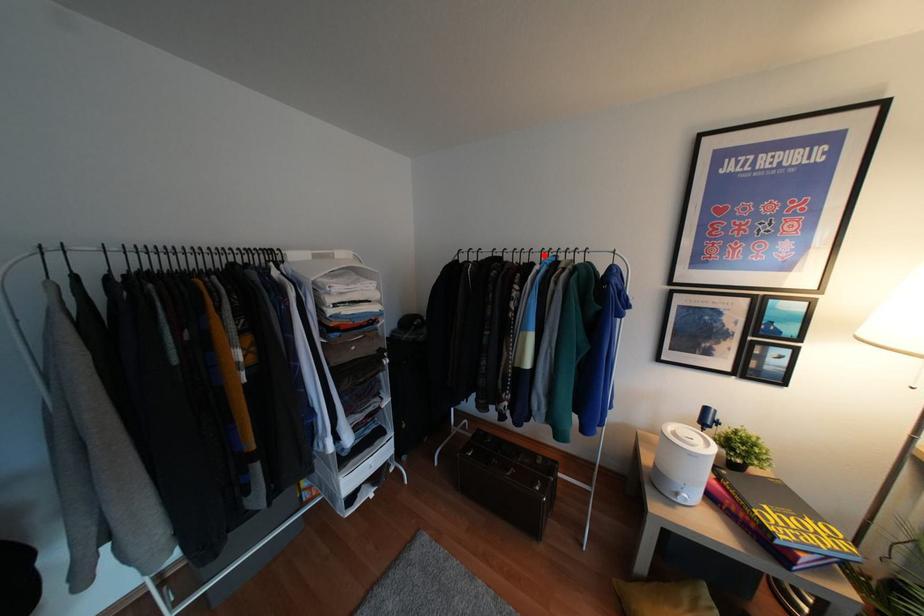
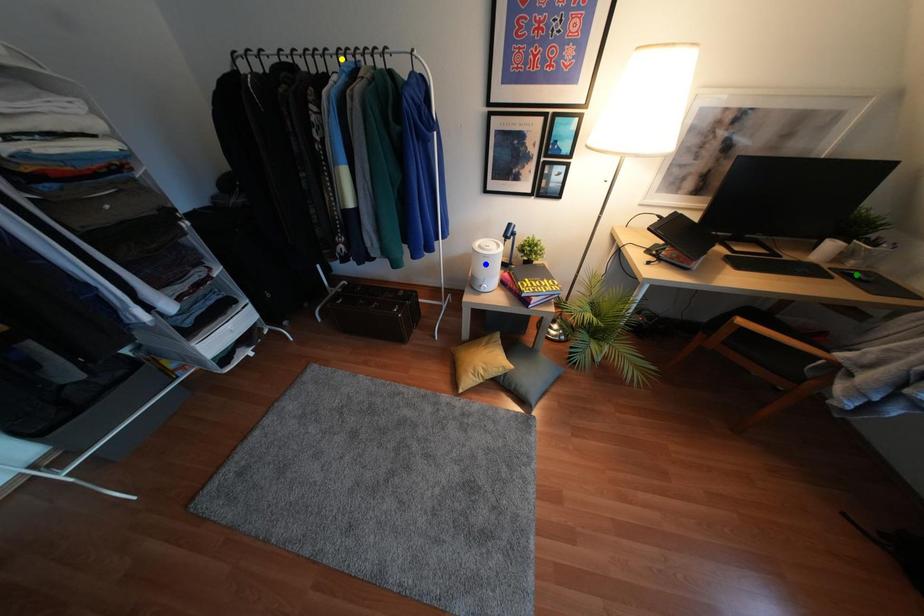
Question: I am providing you with two images of the same scene from different viewpoints. A red point is marked on the first image. You are given multiple points on the second image. Which mark in image 2 goes with the point in image 1?

Choices:
 (A) yellow point
 (B) green point
 (C) blue point

Answer: (A)